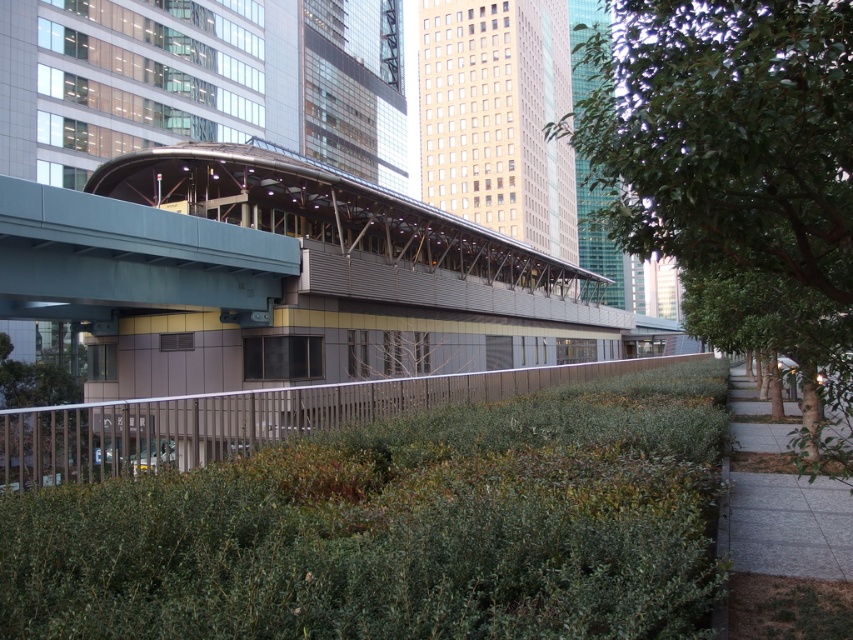
Question: Can you confirm if silver metallic rail at center is positioned above gray concrete sidewalk at lower right?

Choices:
 (A) no
 (B) yes

Answer: (A)

Question: Can you confirm if green leafy tree at right is positioned to the right of silver metallic rail at center?

Choices:
 (A) no
 (B) yes

Answer: (B)

Question: Among these points, which one is farthest from the camera?

Choices:
 (A) (827, 218)
 (B) (392, 586)

Answer: (A)

Question: Which point is closer to the camera?

Choices:
 (A) (523, 496)
 (B) (740, 477)
 (C) (720, 189)

Answer: (C)

Question: Which of these objects is positioned closest to the gray concrete sidewalk at lower right?

Choices:
 (A) green leafy tree at right
 (B) green leafy hedge at lower center

Answer: (B)

Question: Is green leafy hedge at lower center closer to camera compared to silver metallic rail at center?

Choices:
 (A) no
 (B) yes

Answer: (B)